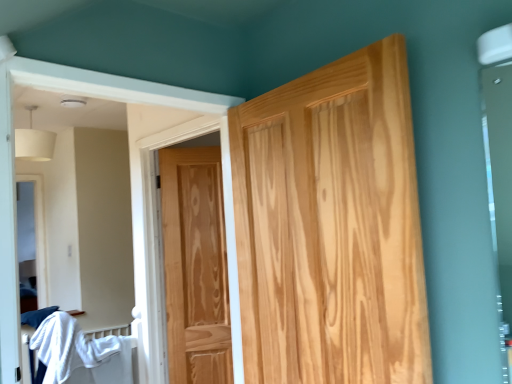
Question: Is white cotton bed at lower left touching natural wood door at center, positioned as the second door in front-to-back order?

Choices:
 (A) no
 (B) yes

Answer: (A)

Question: Does white cotton bed at lower left appear on the right side of natural wood door at center, which is the 1th door in back-to-front order?

Choices:
 (A) yes
 (B) no

Answer: (B)

Question: From a real-world perspective, is white cotton bed at lower left below natural wood door at center, placed as the 1th door when sorted from left to right?

Choices:
 (A) no
 (B) yes

Answer: (B)

Question: Is white cotton bed at lower left aimed at natural wood door at center, the 2th door in the right-to-left sequence?

Choices:
 (A) no
 (B) yes

Answer: (A)

Question: Is white cotton bed at lower left positioned before natural wood door at center, positioned as the second door in front-to-back order?

Choices:
 (A) yes
 (B) no

Answer: (A)

Question: Is point (54, 355) positioned closer to the camera than point (192, 274)?

Choices:
 (A) farther
 (B) closer

Answer: (B)

Question: Is white cotton bed at lower left inside the boundaries of natural wood door at center, which is the 1th door in back-to-front order, or outside?

Choices:
 (A) inside
 (B) outside

Answer: (B)

Question: From the image's perspective, is white cotton bed at lower left positioned above or below natural wood door at center, the 2th door in the right-to-left sequence?

Choices:
 (A) below
 (B) above

Answer: (A)

Question: Considering their positions, is white cotton bed at lower left located in front of or behind natural wood door at center, placed as the 1th door when sorted from left to right?

Choices:
 (A) front
 (B) behind

Answer: (A)

Question: From the image's perspective, is natural wood door at center, placed as the 1th door when sorted from left to right, positioned above or below white cotton bed at lower left?

Choices:
 (A) above
 (B) below

Answer: (A)

Question: Is point (170, 243) closer or farther from the camera than point (53, 357)?

Choices:
 (A) farther
 (B) closer

Answer: (A)

Question: Considering the positions of natural wood door at center, which is the 1th door in back-to-front order, and white cotton bed at lower left in the image, is natural wood door at center, which is the 1th door in back-to-front order, taller or shorter than white cotton bed at lower left?

Choices:
 (A) tall
 (B) short

Answer: (A)

Question: From a real-world perspective, is natural wood door at center, which is the 1th door in back-to-front order, physically located above or below white cotton bed at lower left?

Choices:
 (A) below
 (B) above

Answer: (B)

Question: Do you think white cotton bed at lower left is within natural wood door at center, the first door viewed from the right, or outside of it?

Choices:
 (A) inside
 (B) outside

Answer: (B)

Question: Based on their sizes in the image, would you say white cotton bed at lower left is bigger or smaller than natural wood door at center, acting as the 1th door starting from the front?

Choices:
 (A) small
 (B) big

Answer: (B)